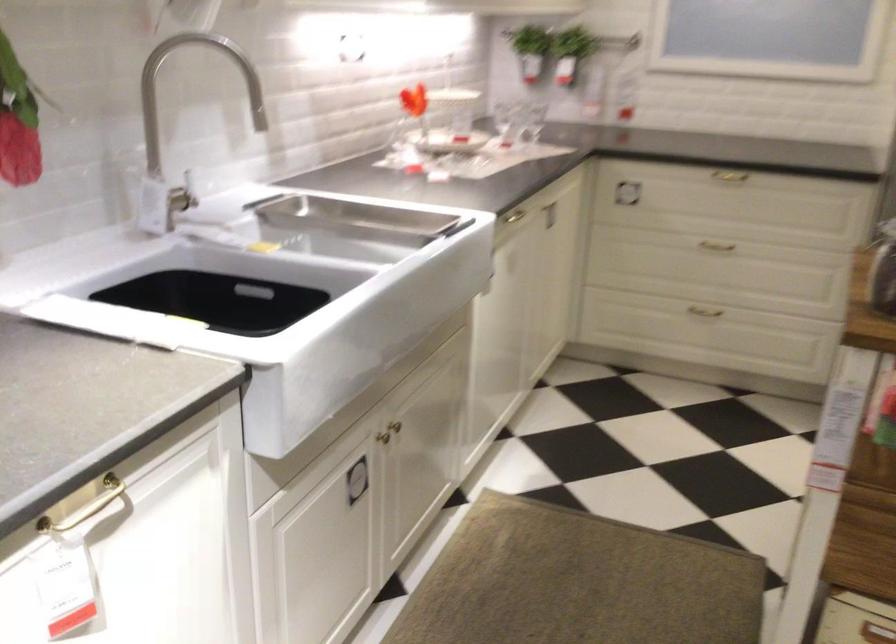
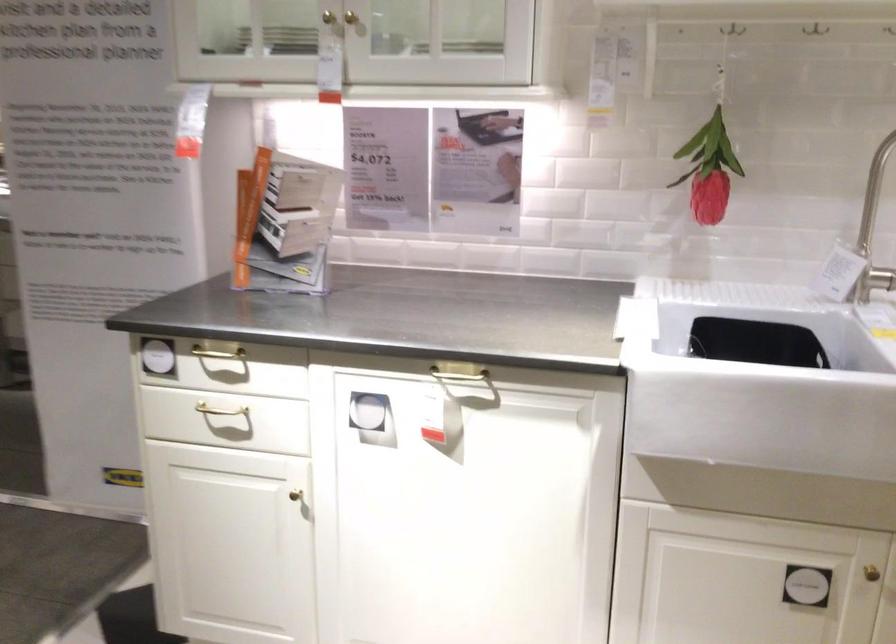
Locate, in the second image, the point that corresponds to point (382, 435) in the first image.

(871, 573)